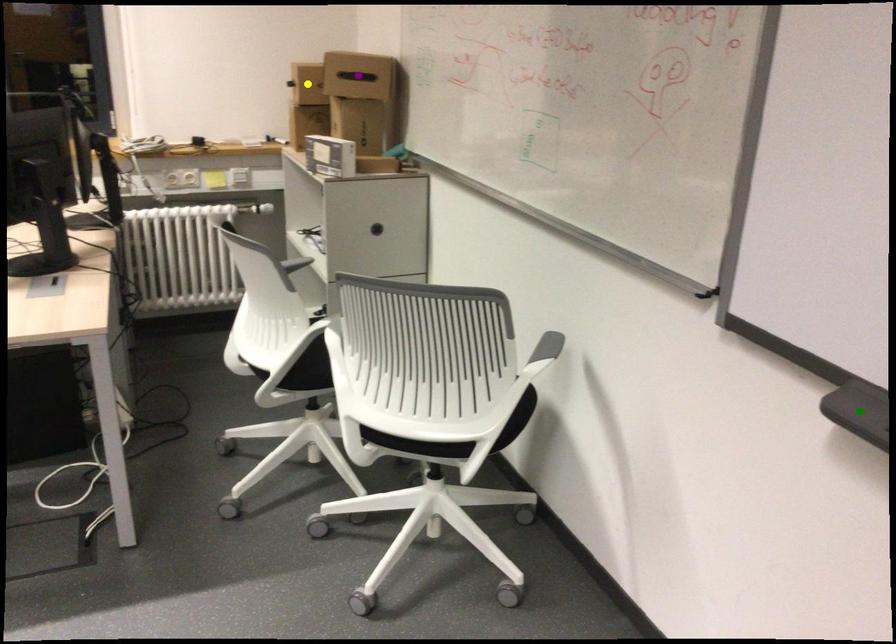
Order these from nearest to farthest:
green point, purple point, yellow point

green point → purple point → yellow point